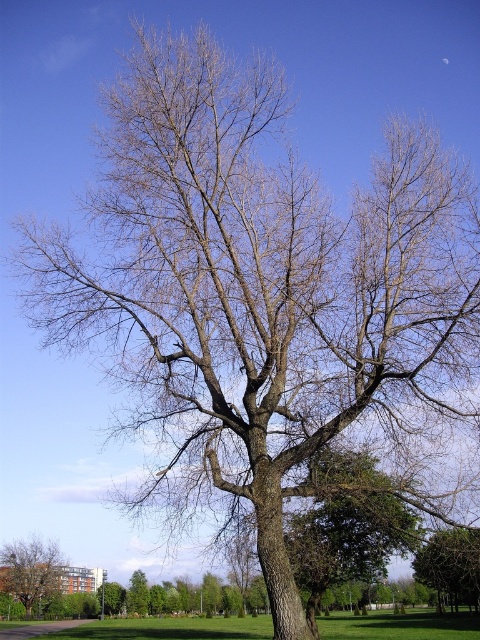
Which is in front, point (300, 531) or point (133, 600)?

Positioned in front is point (300, 531).

How distant is green leafy tree at center from brown rough tree at center?

The distance of green leafy tree at center from brown rough tree at center is 11.74 meters.

Is point (395, 504) farther from viewer compared to point (136, 577)?

No, (395, 504) is in front of (136, 577).

I want to click on green leafy tree at center, so click(347, 524).

Can you confirm if green leafy tree at center is bigger than green leafy tree at lower right?

No, green leafy tree at center is not bigger than green leafy tree at lower right.

Does green leafy tree at center lie behind green leafy tree at lower right?

Yes, green leafy tree at center is further from the viewer.

Is point (385, 552) more distant than point (439, 545)?

Yes, it is.

Where is `green leafy tree at center`? The width and height of the screenshot is (480, 640). green leafy tree at center is located at coordinates (347, 524).

Does green leafy tree at lower right have a greater width compared to brown rough tree at lower left?

Yes.

Which is below, green leafy tree at lower right or brown rough tree at lower left?

Positioned lower is brown rough tree at lower left.

Identify the location of green leafy tree at lower right. (451, 564).